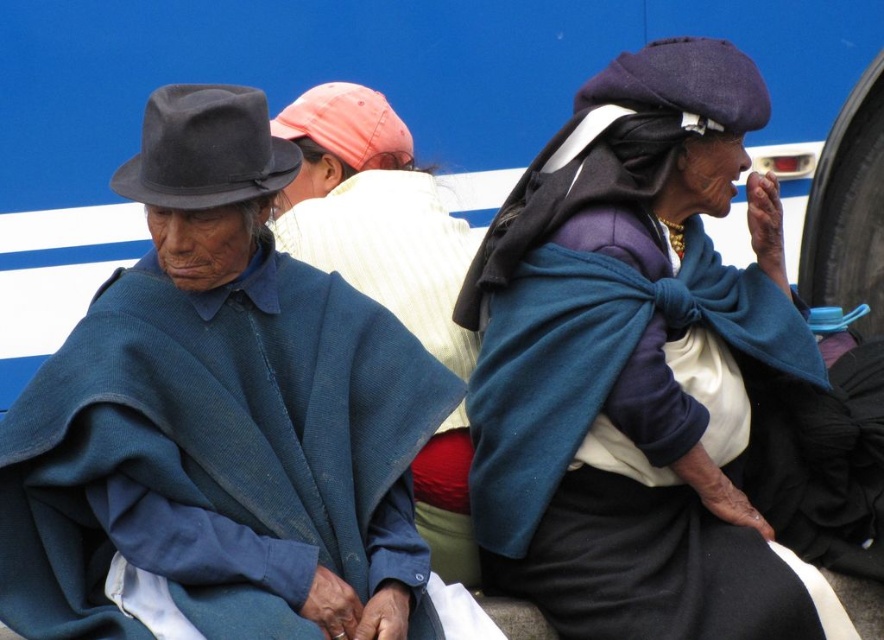
Question: Which point is closer to the camera?

Choices:
 (A) (459, 454)
 (B) (184, 326)
 (C) (501, 538)

Answer: (B)

Question: Is matte blue shawl at center wider than blue woolen poncho at center?

Choices:
 (A) yes
 (B) no

Answer: (B)

Question: Which of the following is the closest to the observer?

Choices:
 (A) (751, 288)
 (B) (65, 508)

Answer: (B)

Question: Which is farther from the matte blue shawl at center?

Choices:
 (A) matte blue poncho at left
 (B) blue woolen poncho at center

Answer: (A)

Question: Can you confirm if matte blue poncho at left is positioned below matte blue shawl at center?

Choices:
 (A) no
 (B) yes

Answer: (B)

Question: Is matte blue poncho at left positioned before blue woolen poncho at center?

Choices:
 (A) yes
 (B) no

Answer: (A)